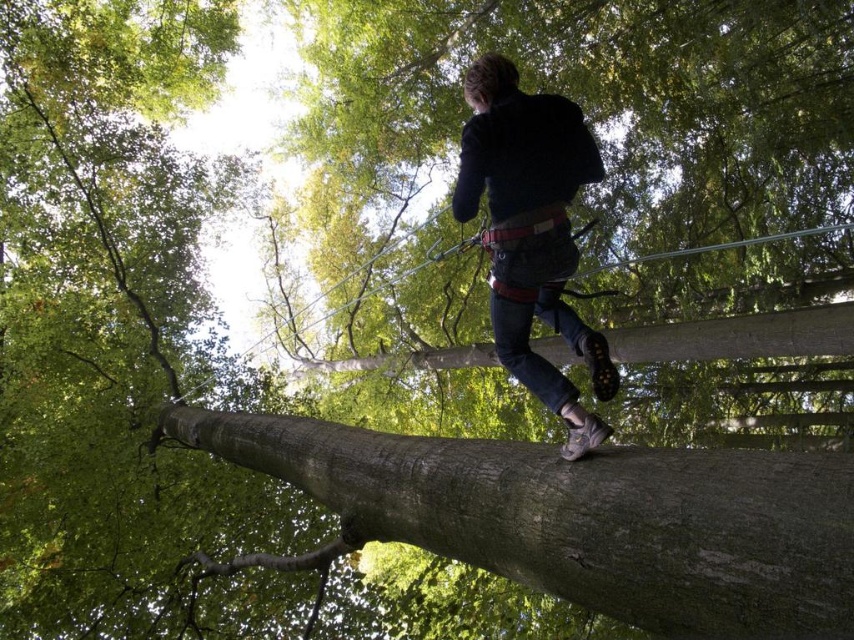
Question: Is brown rough tree trunk at center to the right of dark blue jeans at center from the viewer's perspective?

Choices:
 (A) yes
 (B) no

Answer: (B)

Question: Can you confirm if brown rough tree trunk at center is positioned above dark blue jeans at center?

Choices:
 (A) no
 (B) yes

Answer: (A)

Question: Is brown rough tree trunk at center smaller than dark blue jeans at center?

Choices:
 (A) yes
 (B) no

Answer: (B)

Question: Which object is closer to the camera taking this photo?

Choices:
 (A) dark blue jeans at center
 (B) brown rough tree trunk at center

Answer: (B)